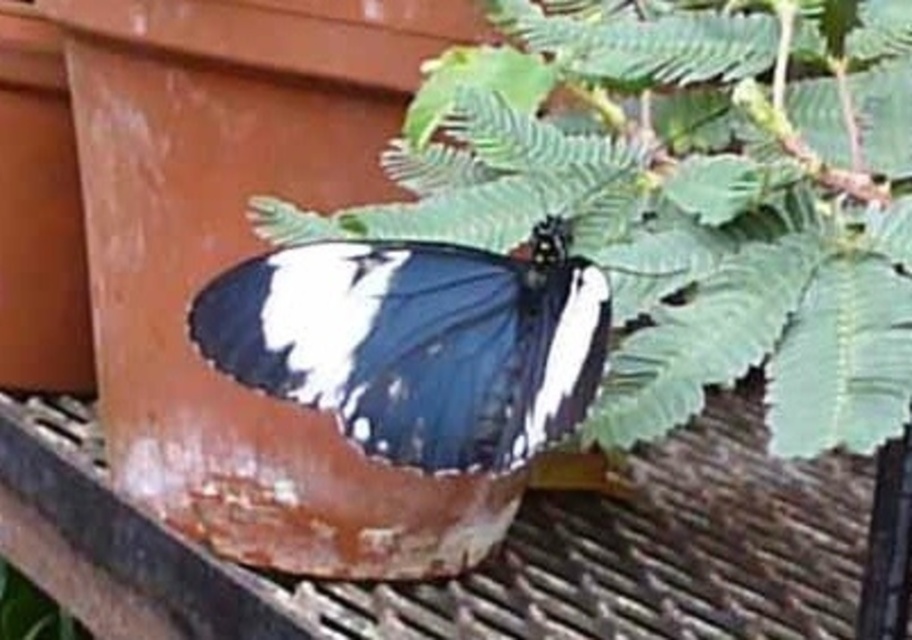
Question: Is green leafy plant at upper center to the right of shiny blue and white butterfly at center from the viewer's perspective?

Choices:
 (A) yes
 (B) no

Answer: (A)

Question: Which object appears farthest from the camera in this image?

Choices:
 (A) shiny blue and white butterfly at center
 (B) green leafy plant at upper center

Answer: (A)

Question: Does green leafy plant at upper center appear under shiny blue and white butterfly at center?

Choices:
 (A) yes
 (B) no

Answer: (B)

Question: Is green leafy plant at upper center to the left of shiny blue and white butterfly at center from the viewer's perspective?

Choices:
 (A) yes
 (B) no

Answer: (B)

Question: Which point is closer to the camera?

Choices:
 (A) shiny blue and white butterfly at center
 (B) green leafy plant at upper center

Answer: (B)